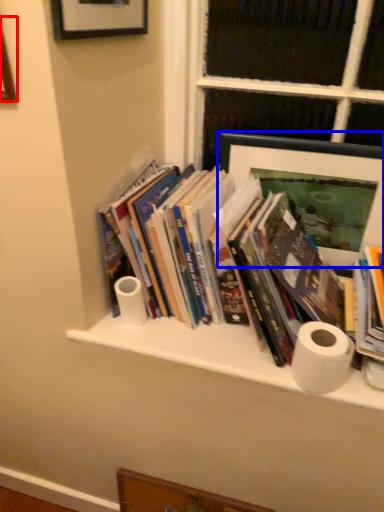
Question: Which object appears closest to the camera in this image, picture frame (highlighted by a red box) or picture frame (highlighted by a blue box)?

Choices:
 (A) picture frame
 (B) picture frame

Answer: (A)